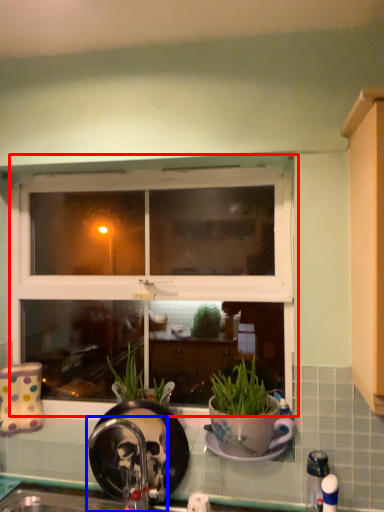
Question: Which object appears farthest to the camera in this image, window (highlighted by a red box) or faucet (highlighted by a blue box)?

Choices:
 (A) window
 (B) faucet

Answer: (A)